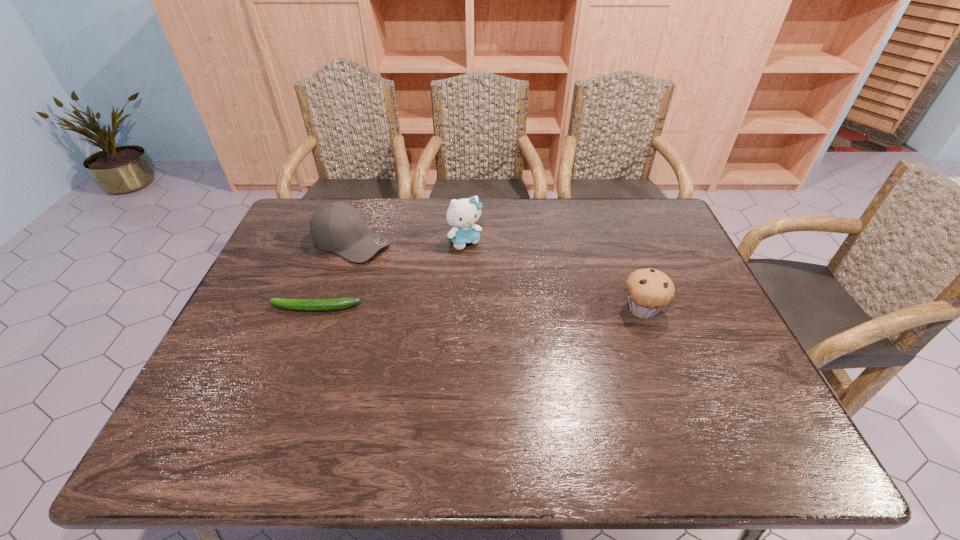
Locate an element on the screen. vacant position at the near edge of the desktop is located at coordinates (519, 397).

The width and height of the screenshot is (960, 540). I want to click on vacant space at the left edge of the desktop, so click(x=272, y=260).

The height and width of the screenshot is (540, 960). I want to click on free region at the right edge of the desktop, so click(x=688, y=273).

Image resolution: width=960 pixels, height=540 pixels. In the image, there is a desktop. Identify the location of vacant space at the near left corner. (271, 388).

Identify the location of vacant space at the far right corner. (670, 236).

Locate an element on the screen. Image resolution: width=960 pixels, height=540 pixels. vacant space that's between the baseball cap and the kitten is located at coordinates (408, 241).

Identify the location of free area in between the shortest object and the baseball cap. This screenshot has width=960, height=540. (333, 275).

You are a GUI agent. You are given a task and a screenshot of the screen. Output one action in this format:
    pyautogui.click(x=<x>, y=<y>)
    Task: Click on the unoccupied area between the tallest object and the muffin
    The height and width of the screenshot is (540, 960).
    Given the screenshot: What is the action you would take?
    pyautogui.click(x=554, y=275)

Find the location of a particular element. Image resolution: width=960 pixels, height=540 pixels. vacant region between the shortest object and the baseball cap is located at coordinates 333,275.

Find the location of a particular element. This screenshot has width=960, height=540. free space between the shortest object and the second object from right to left is located at coordinates (391, 274).